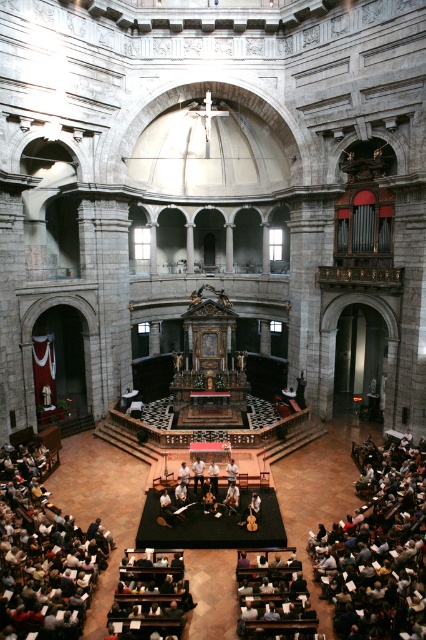
Question: Does white paper at lower left appear over light brown leather jacket at center?

Choices:
 (A) no
 (B) yes

Answer: (A)

Question: Which of the following is the farthest from the observer?

Choices:
 (A) white fabric at center
 (B) light brown leather jacket at center
 (C) white paper at lower left

Answer: (B)

Question: Is light brown leather jacket at center to the left of white fabric at center from the viewer's perspective?

Choices:
 (A) no
 (B) yes

Answer: (B)

Question: Which point is farther from the camera taking this photo?

Choices:
 (A) (201, 470)
 (B) (227, 472)

Answer: (A)

Question: Does white paper at lower left have a larger size compared to light brown leather jacket at center?

Choices:
 (A) yes
 (B) no

Answer: (A)

Question: Considering the real-world distances, which object is closest to the white paper at lower left?

Choices:
 (A) white fabric at center
 (B) light brown leather jacket at center
 (C) dark gray fabric at lower right

Answer: (B)